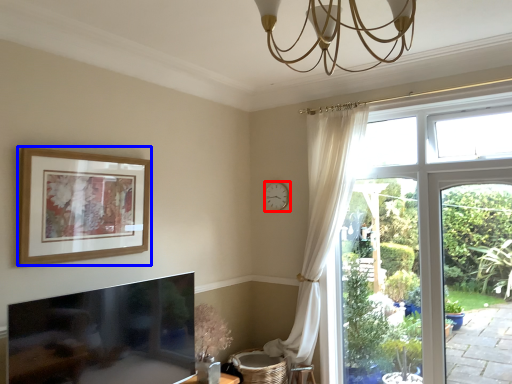
Question: Which of the following is the farthest to the observer, clock (highlighted by a red box) or picture frame (highlighted by a blue box)?

Choices:
 (A) clock
 (B) picture frame

Answer: (A)